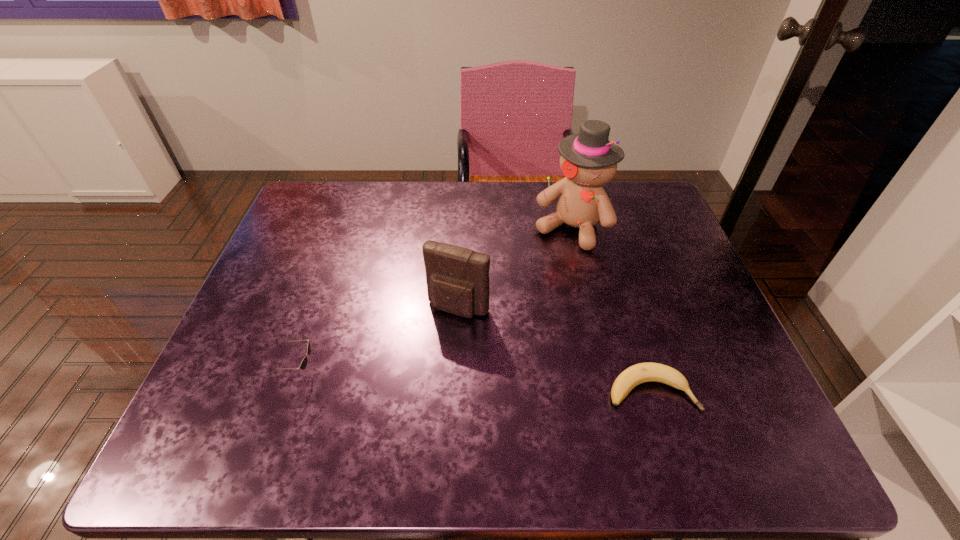
This screenshot has width=960, height=540. In order to click on vacant space located on the front-facing side of the farthest object in this screenshot , I will do `click(500, 343)`.

The image size is (960, 540). I want to click on vacant space located 0.300m on the front-facing side of the farthest object, so click(512, 325).

The height and width of the screenshot is (540, 960). I want to click on free space located with an open flap on the pouch, so click(x=431, y=351).

This screenshot has height=540, width=960. In order to click on vacant region located with an open flap on the pouch in this screenshot , I will do `click(433, 348)`.

You are a GUI agent. You are given a task and a screenshot of the screen. Output one action in this format:
    pyautogui.click(x=<x>, y=<y>)
    Task: Click on the vacant space located 0.210m with an open flap on the pouch
    The height and width of the screenshot is (540, 960).
    Given the screenshot: What is the action you would take?
    pyautogui.click(x=407, y=397)

You are a GUI agent. You are given a task and a screenshot of the screen. Output one action in this format:
    pyautogui.click(x=<x>, y=<y>)
    Task: Click on the object that is at the far edge
    
    Given the screenshot: What is the action you would take?
    pyautogui.click(x=588, y=160)

Identify the location of sunglasses that is positioned at the near edge. Image resolution: width=960 pixels, height=540 pixels. (303, 364).

The width and height of the screenshot is (960, 540). I want to click on banana at the near edge, so click(x=643, y=372).

Locate an element on the screen. This screenshot has width=960, height=540. object at the left edge is located at coordinates (303, 364).

The image size is (960, 540). What are the coordinates of `object that is at the right edge` in the screenshot? It's located at (643, 372).